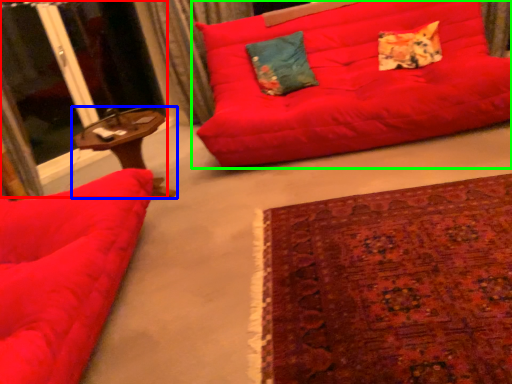
Question: Estimate the real-world distances between objects in this image. Which object is closer to screen door (highlighted by a red box), table (highlighted by a blue box) or studio couch (highlighted by a green box)?

Choices:
 (A) table
 (B) studio couch

Answer: (A)